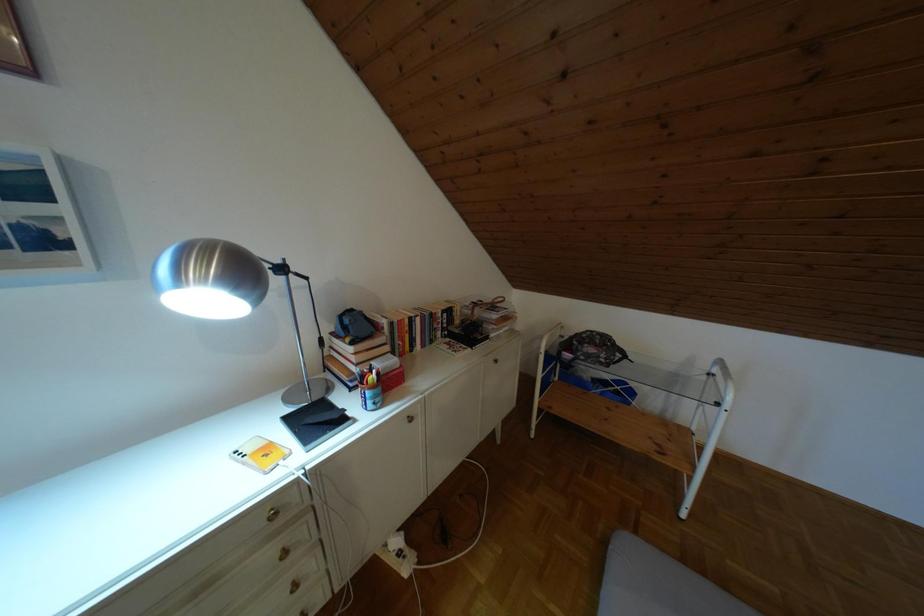
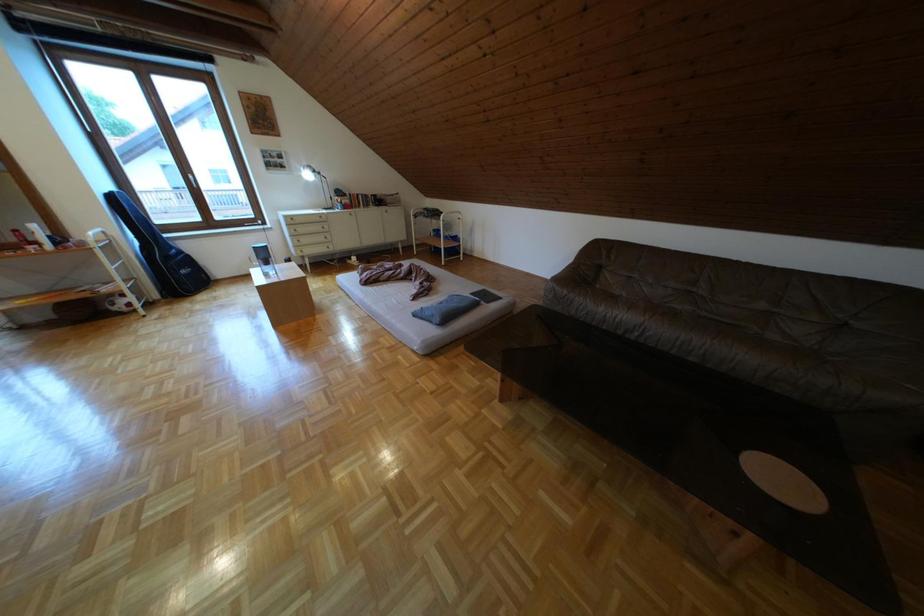
Which direction would the cameraman need to move to produce the second image?

The cameraman walked toward right, backward.